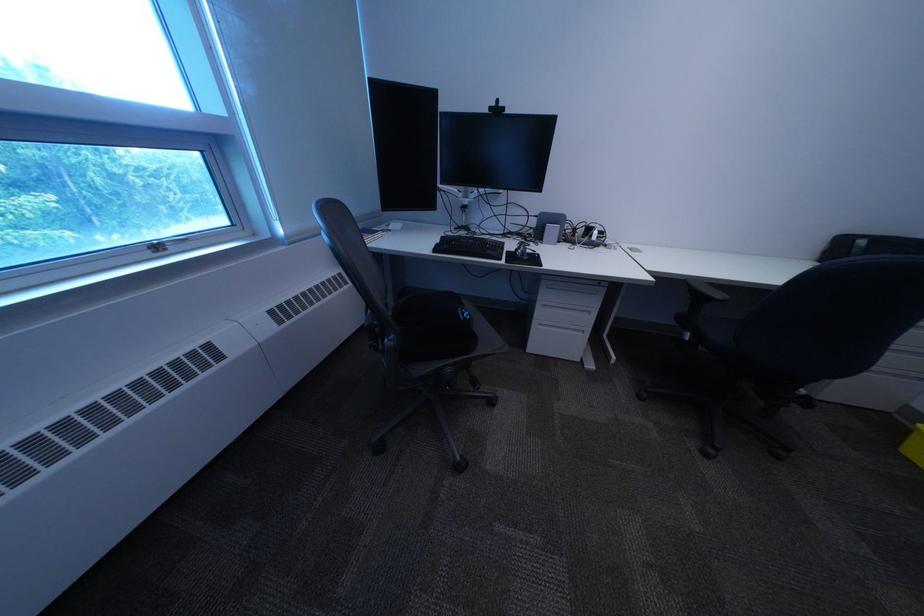
I want to click on blind pull chain, so click(x=237, y=111).